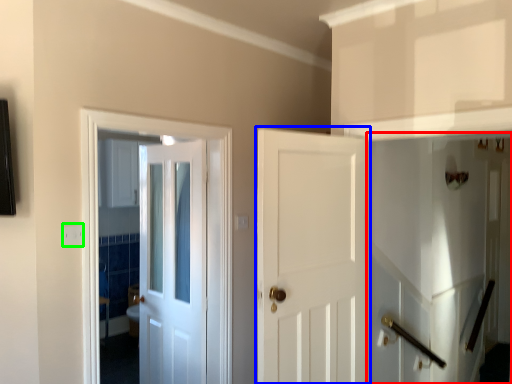
Question: Which object is the farthest from elevator (highlighted by a red box)? Choose among these: door (highlighted by a blue box) or electric outlet (highlighted by a green box).

Choices:
 (A) door
 (B) electric outlet

Answer: (B)